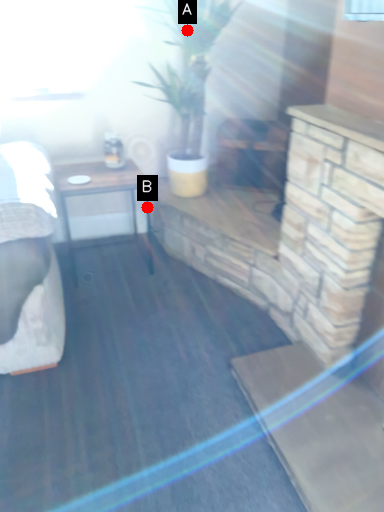
Question: Two points are circled on the image, labeled by A and B beside each circle. Which point appears closest to the camera in this image?

Choices:
 (A) A is closer
 (B) B is closer

Answer: (A)